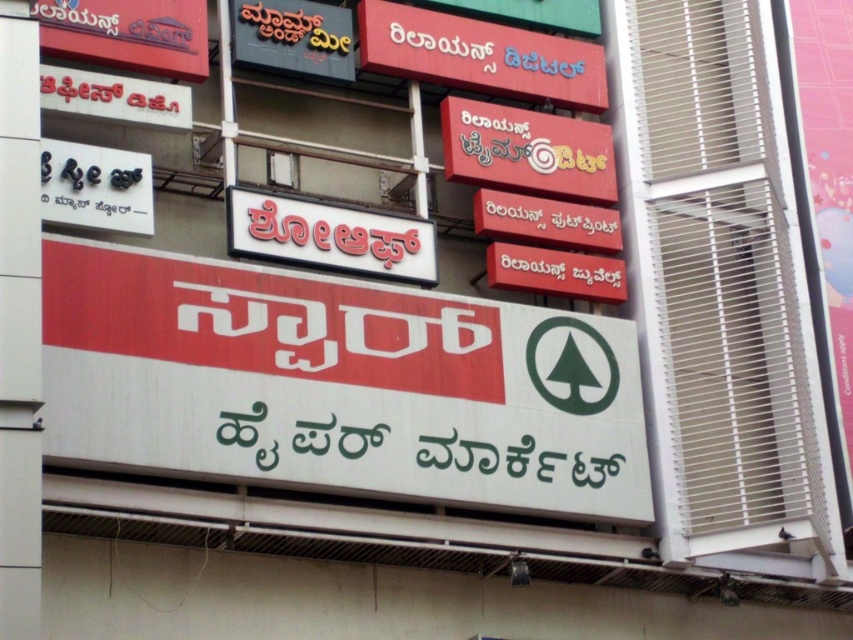
Measure the distance from white glossy signboard at upper left to matte black signboard at upper center.

They are 8.36 meters apart.

Is point (128, 154) in front of point (238, 51)?

Yes, it is in front of point (238, 51).

Does point (108, 188) come in front of point (302, 38)?

Yes, point (108, 188) is in front of point (302, 38).

This screenshot has width=853, height=640. I want to click on white glossy signboard at upper left, so click(x=96, y=188).

Between point (538, 36) and point (100, 160), which one is positioned in front?

Point (100, 160) is more forward.

Locate an element on the screen. The width and height of the screenshot is (853, 640). red matte signboard at upper center is located at coordinates (480, 54).

Does point (544, 154) lie in front of point (250, 1)?

No.

Can you confirm if matte red signboard at upper center is positioned above matte black signboard at upper center?

No.

Is point (596, 173) farther from camera compared to point (303, 74)?

Yes, it is.

The width and height of the screenshot is (853, 640). I want to click on matte red signboard at upper center, so click(x=527, y=150).